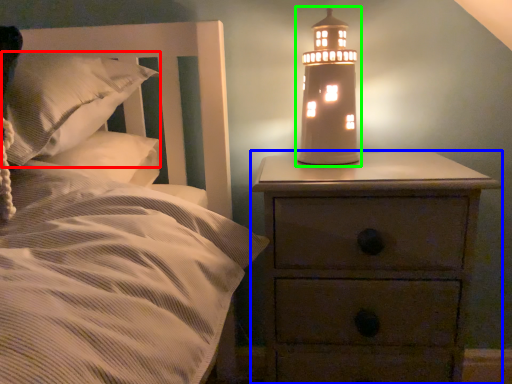
Question: Which is nearer to the pillow (highlighted by a red box)? nightstand (highlighted by a blue box) or oil lamp (highlighted by a green box).

Choices:
 (A) nightstand
 (B) oil lamp

Answer: (B)